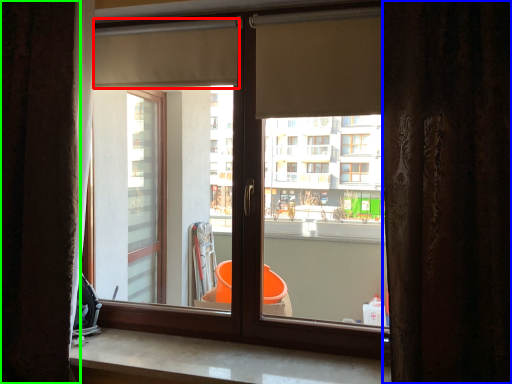
Question: Based on their relative distances, which object is nearer to shutter (highlighted by a red box)? Choose from curtain (highlighted by a blue box) and curtain (highlighted by a green box).

Choices:
 (A) curtain
 (B) curtain

Answer: (B)